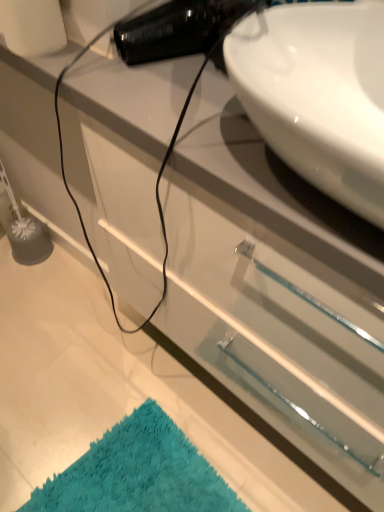
Question: From the image's perspective, is teal shaggy bath mat at lower left located above or below white glossy sink at upper right?

Choices:
 (A) above
 (B) below

Answer: (B)

Question: Does point (107, 478) appear closer or farther from the camera than point (331, 17)?

Choices:
 (A) farther
 (B) closer

Answer: (A)

Question: In terms of width, does teal shaggy bath mat at lower left look wider or thinner when compared to white glossy sink at upper right?

Choices:
 (A) thin
 (B) wide

Answer: (A)

Question: Does point (302, 82) appear closer or farther from the camera than point (200, 501)?

Choices:
 (A) closer
 (B) farther

Answer: (A)

Question: Would you say white glossy sink at upper right is to the left or to the right of teal shaggy bath mat at lower left in the picture?

Choices:
 (A) left
 (B) right

Answer: (B)

Question: Considering the positions of white glossy sink at upper right and teal shaggy bath mat at lower left in the image, is white glossy sink at upper right bigger or smaller than teal shaggy bath mat at lower left?

Choices:
 (A) small
 (B) big

Answer: (B)

Question: Considering the positions of white glossy sink at upper right and teal shaggy bath mat at lower left in the image, is white glossy sink at upper right wider or thinner than teal shaggy bath mat at lower left?

Choices:
 (A) wide
 (B) thin

Answer: (A)